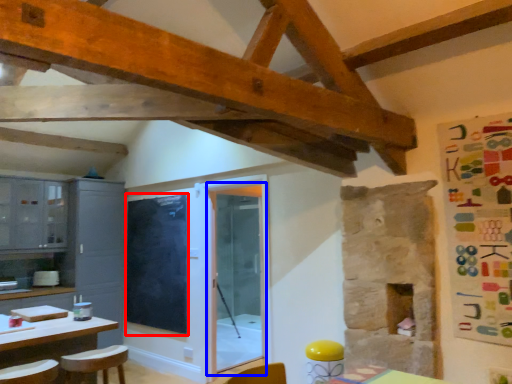
Question: Which object is further to the camera taking this photo, window screen (highlighted by a red box) or glass door (highlighted by a blue box)?

Choices:
 (A) window screen
 (B) glass door

Answer: (A)